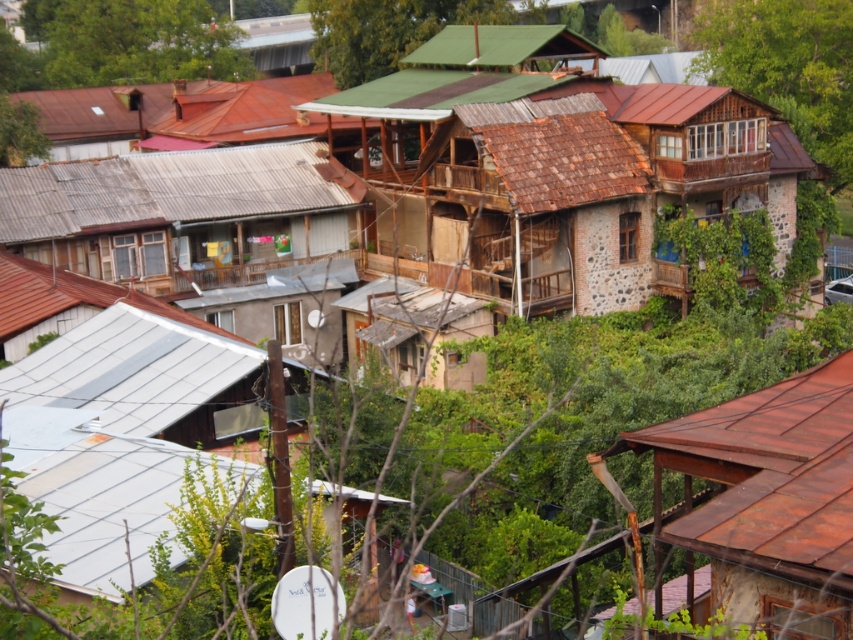
You are an urban planner reviewing this area. You notice two trees in the upper part of the image. Which tree is positioned lower between the green wood tree at upper right and the green leafy tree at upper center?

The green wood tree at upper right is located below the green leafy tree at upper center, so it is positioned lower than the other.

You are standing in the residential area and want to take a photo of the rusty wood house at center without the green leafy tree at upper center blocking the view. Is this possible?

The rusty wood house at center is in front of green leafy tree at upper center, so you cannot take a photo of the rusty wood house at center without the green leafy tree at upper center blocking the view.